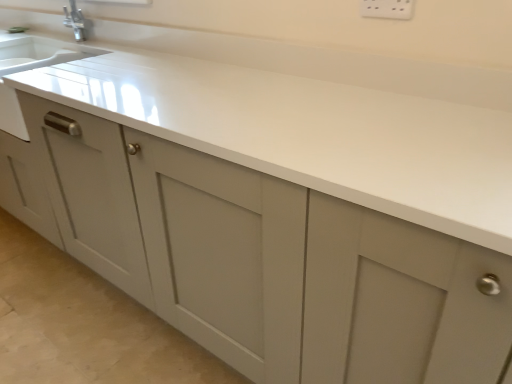
What is the approximate height of white plastic electric outlet at upper center?

The height of white plastic electric outlet at upper center is 3.53 inches.

The image size is (512, 384). Describe the element at coordinates (387, 9) in the screenshot. I see `white plastic electric outlet at upper center` at that location.

Locate an element on the screen. white plastic electric outlet at upper center is located at coordinates (387, 9).

Find the location of a particular element. The width and height of the screenshot is (512, 384). white matte countertop at center is located at coordinates (314, 119).

What do you see at coordinates (314, 119) in the screenshot? I see `white matte countertop at center` at bounding box center [314, 119].

You are a GUI agent. You are given a task and a screenshot of the screen. Output one action in this format:
    pyautogui.click(x=<x>, y=<y>)
    Task: Click on the white plastic electric outlet at upper center
    This screenshot has height=384, width=512.
    Given the screenshot: What is the action you would take?
    pyautogui.click(x=387, y=9)

Considering the relative positions of white plastic electric outlet at upper center and white matte countertop at center in the image provided, is white plastic electric outlet at upper center to the left of white matte countertop at center from the viewer's perspective?

Incorrect, white plastic electric outlet at upper center is not on the left side of white matte countertop at center.

Between white plastic electric outlet at upper center and white matte countertop at center, which one is positioned in front?

Positioned in front is white matte countertop at center.

Which is in front, point (362, 12) or point (255, 145)?

Point (255, 145)

From the image's perspective, which object appears higher, white plastic electric outlet at upper center or white matte countertop at center?

white plastic electric outlet at upper center, from the image's perspective.

From a real-world perspective, which is physically below, white plastic electric outlet at upper center or white matte countertop at center?

white matte countertop at center is physically lower.

Between white plastic electric outlet at upper center and white matte countertop at center, which one has larger width?

With larger width is white matte countertop at center.

Does white plastic electric outlet at upper center have a lesser height compared to white matte countertop at center?

Indeed, white plastic electric outlet at upper center has a lesser height compared to white matte countertop at center.

In terms of size, does white plastic electric outlet at upper center appear bigger or smaller than white matte countertop at center?

Considering their sizes, white plastic electric outlet at upper center takes up less space than white matte countertop at center.

Is white plastic electric outlet at upper center inside the boundaries of white matte countertop at center, or outside?

white plastic electric outlet at upper center cannot be found inside white matte countertop at center.

In the scene shown: Is white plastic electric outlet at upper center far from white matte countertop at center?

No.

Is white plastic electric outlet at upper center aimed at white matte countertop at center?

No, white plastic electric outlet at upper center is not facing towards white matte countertop at center.

How different are the orientations of white plastic electric outlet at upper center and white matte countertop at center in degrees?

The facing directions of white plastic electric outlet at upper center and white matte countertop at center are 1.89 degrees apart.

You are a GUI agent. You are given a task and a screenshot of the screen. Output one action in this format:
    pyautogui.click(x=<x>, y=<y>)
    Task: Click on the countertop that appears below the white plastic electric outlet at upper center (from a real-world perspective)
    Image resolution: width=512 pixels, height=384 pixels.
    Given the screenshot: What is the action you would take?
    pyautogui.click(x=314, y=119)

Considering the positions of objects white matte countertop at center and white plastic electric outlet at upper center in the image provided, who is more to the right, white matte countertop at center or white plastic electric outlet at upper center?

Positioned to the right is white plastic electric outlet at upper center.

Who is more distant, white matte countertop at center or white plastic electric outlet at upper center?

white plastic electric outlet at upper center is further from the camera.

Considering the positions of points (175, 39) and (404, 0), is point (175, 39) closer to camera compared to point (404, 0)?

No, it is not.

From the image's perspective, is white matte countertop at center located above white plastic electric outlet at upper center?

Actually, white matte countertop at center appears below white plastic electric outlet at upper center in the image.

From a real-world perspective, is white matte countertop at center physically located above or below white plastic electric outlet at upper center?

white matte countertop at center is below white plastic electric outlet at upper center.

From the picture: Is white matte countertop at center wider or thinner than white plastic electric outlet at upper center?

Clearly, white matte countertop at center has more width compared to white plastic electric outlet at upper center.

Between white matte countertop at center and white plastic electric outlet at upper center, which one has less height?

white plastic electric outlet at upper center.

Who is bigger, white matte countertop at center or white plastic electric outlet at upper center?

white matte countertop at center is bigger.

Is white matte countertop at center spatially inside white plastic electric outlet at upper center, or outside of it?

white matte countertop at center is outside white plastic electric outlet at upper center.

Is white matte countertop at center touching white plastic electric outlet at upper center?

No, white matte countertop at center is not making contact with white plastic electric outlet at upper center.

Is white matte countertop at center turned away from white plastic electric outlet at upper center?

No, white plastic electric outlet at upper center is not at the back of white matte countertop at center.

I want to click on electric outlet behind the white matte countertop at center, so click(x=387, y=9).

Locate an element on the screen. The height and width of the screenshot is (384, 512). electric outlet above the white matte countertop at center (from a real-world perspective) is located at coordinates (387, 9).

Find the location of a particular element. This screenshot has height=384, width=512. countertop below the white plastic electric outlet at upper center (from a real-world perspective) is located at coordinates (314, 119).